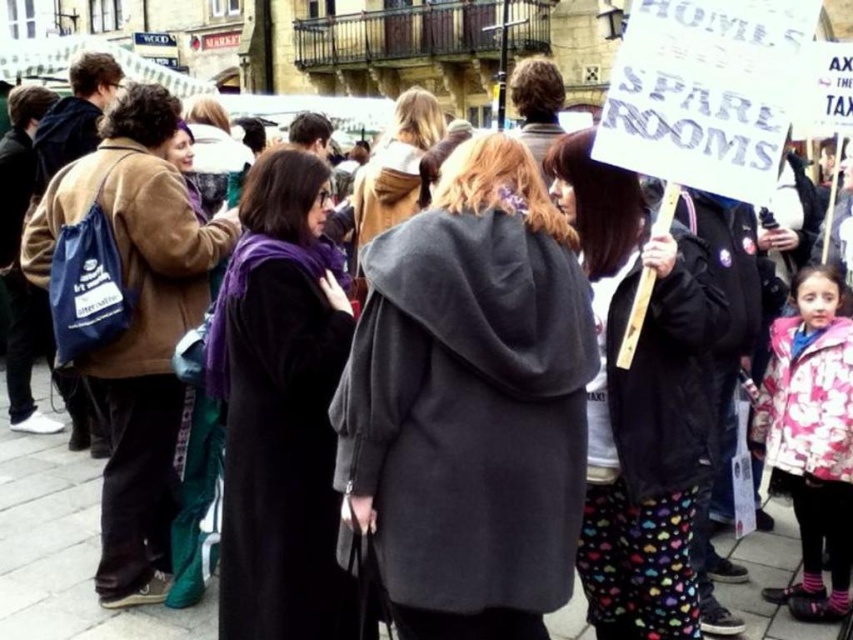
Is purple velvet scarf at center above gray wool coat at center?

No.

Can you confirm if purple velvet scarf at center is thinner than gray wool coat at center?

No, purple velvet scarf at center is not thinner than gray wool coat at center.

Is point (231, 310) positioned in front of point (399, 104)?

Yes.

Find the location of `purple velvet scarf at center`. purple velvet scarf at center is located at coordinates (280, 408).

Who is lower down, dark gray wool coat at center or gray wool coat at center?

dark gray wool coat at center

Who is taller, dark gray wool coat at center or gray wool coat at center?

dark gray wool coat at center

Between point (573, 241) and point (416, 129), which one is positioned behind?

The point (416, 129) is behind.

The width and height of the screenshot is (853, 640). Identify the location of dark gray wool coat at center. (469, 403).

Is dark gray wool coat at center to the right of pink floral coat at lower right from the viewer's perspective?

Incorrect, dark gray wool coat at center is not on the right side of pink floral coat at lower right.

Is dark gray wool coat at center thinner than pink floral coat at lower right?

No.

Which is in front, point (474, 330) or point (798, 280)?

Positioned in front is point (474, 330).

I want to click on dark gray wool coat at center, so click(469, 403).